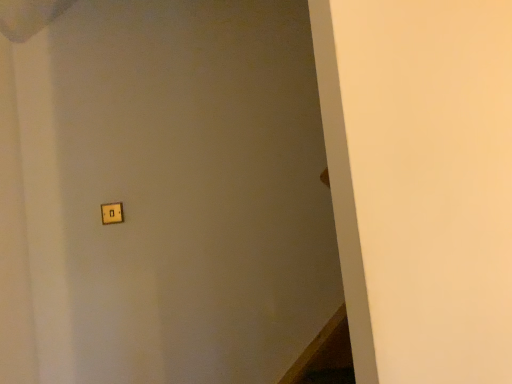
Locate an element on the screen. The height and width of the screenshot is (384, 512). metallic gold light switch at lower left is located at coordinates (112, 213).

This screenshot has width=512, height=384. Describe the element at coordinates (112, 213) in the screenshot. I see `metallic gold light switch at lower left` at that location.

I want to click on metallic gold light switch at lower left, so click(112, 213).